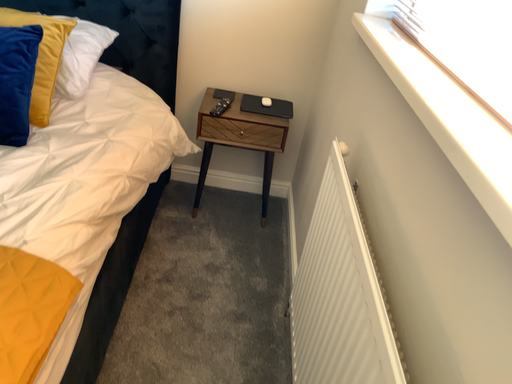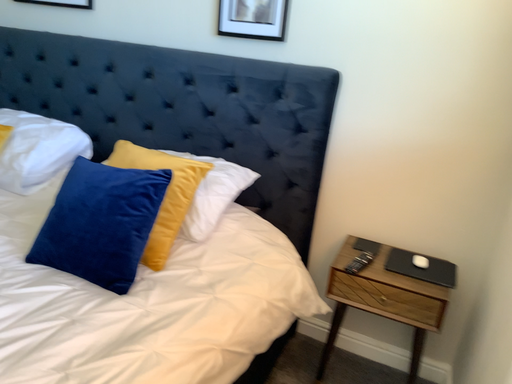
Question: Which way did the camera rotate in the video?

Choices:
 (A) rotated left
 (B) rotated right

Answer: (A)